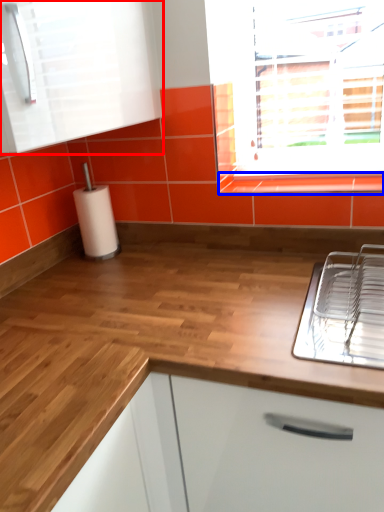
Question: Which point is closer to the camera, cabinetry (highlighted by a red box) or window sill (highlighted by a blue box)?

Choices:
 (A) cabinetry
 (B) window sill

Answer: (A)